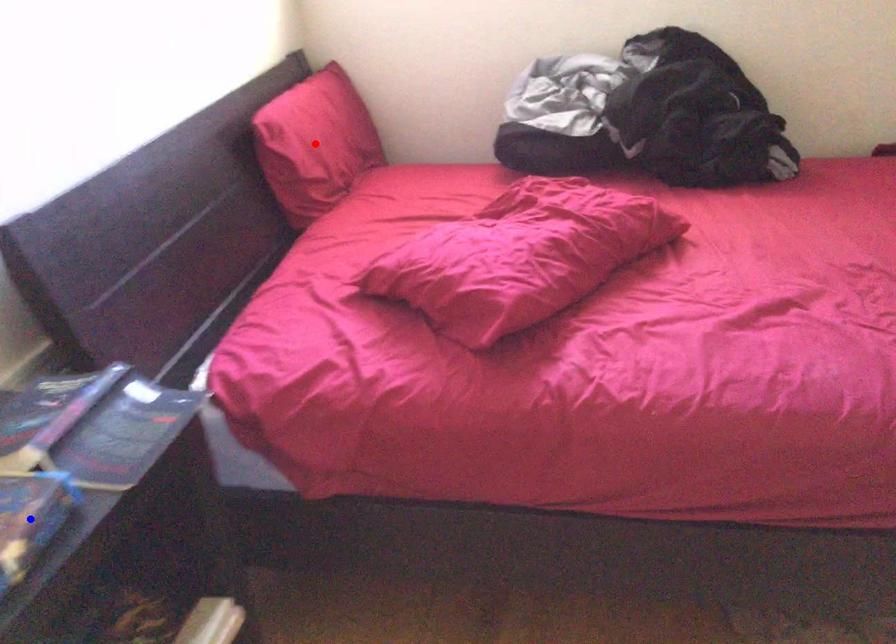
Question: Two points are marked on the image. Which point is closer to the camera?

Choices:
 (A) Blue point is closer.
 (B) Red point is closer.

Answer: (A)